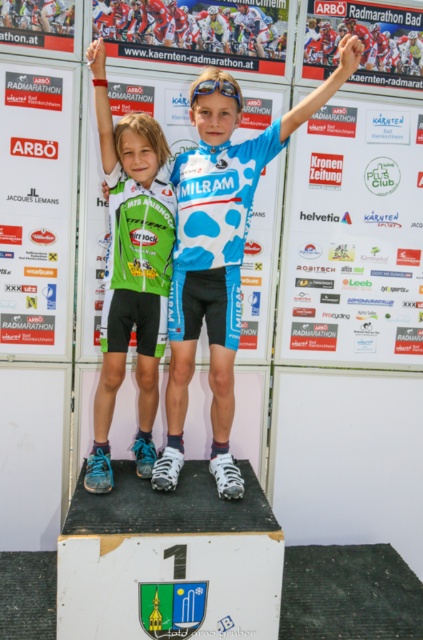
Question: Does matte blue jersey at center come behind green matte jersey at center?

Choices:
 (A) yes
 (B) no

Answer: (B)

Question: Which point is closer to the camera taking this photo?

Choices:
 (A) (153, 480)
 (B) (148, 355)

Answer: (A)

Question: Where is matte blue jersey at center located in relation to green matte jersey at center in the image?

Choices:
 (A) right
 (B) left

Answer: (A)

Question: Is matte blue jersey at center further to the viewer compared to green matte jersey at center?

Choices:
 (A) no
 (B) yes

Answer: (A)

Question: Which point is closer to the camera?

Choices:
 (A) matte blue jersey at center
 (B) green matte jersey at center

Answer: (A)